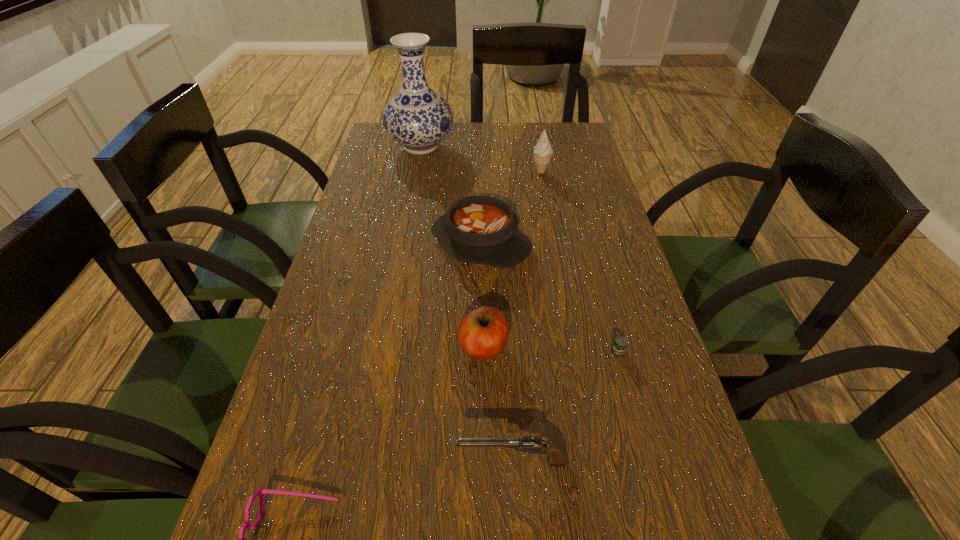
You are a GUI agent. You are given a task and a screenshot of the screen. Output one action in this format:
    pyautogui.click(x=<x>, y=<y>)
    Task: Click on the icecream present at the right edge
    The width and height of the screenshot is (960, 540).
    Given the screenshot: What is the action you would take?
    pyautogui.click(x=542, y=151)

I want to click on beer can that is positioned at the right edge, so click(x=620, y=343).

Locate an element on the screen. The width and height of the screenshot is (960, 540). object at the far left corner is located at coordinates (417, 117).

The image size is (960, 540). Find the location of `vacant space at the far edge`. vacant space at the far edge is located at coordinates (494, 131).

The height and width of the screenshot is (540, 960). I want to click on vacant space at the left edge, so click(x=337, y=408).

This screenshot has width=960, height=540. In the image, there is a desktop. Find the location of `free space at the right edge`. free space at the right edge is located at coordinates (580, 198).

Image resolution: width=960 pixels, height=540 pixels. In order to click on vacant area at the far right corner of the desktop in this screenshot , I will do `click(556, 136)`.

Where is `free space between the apple and the beer can`? The height and width of the screenshot is (540, 960). free space between the apple and the beer can is located at coordinates (550, 349).

The width and height of the screenshot is (960, 540). I want to click on vacant space that is in between the casserole and the apple, so tap(482, 295).

This screenshot has height=540, width=960. I want to click on free spot between the apple and the fifth nearest object, so click(x=482, y=295).